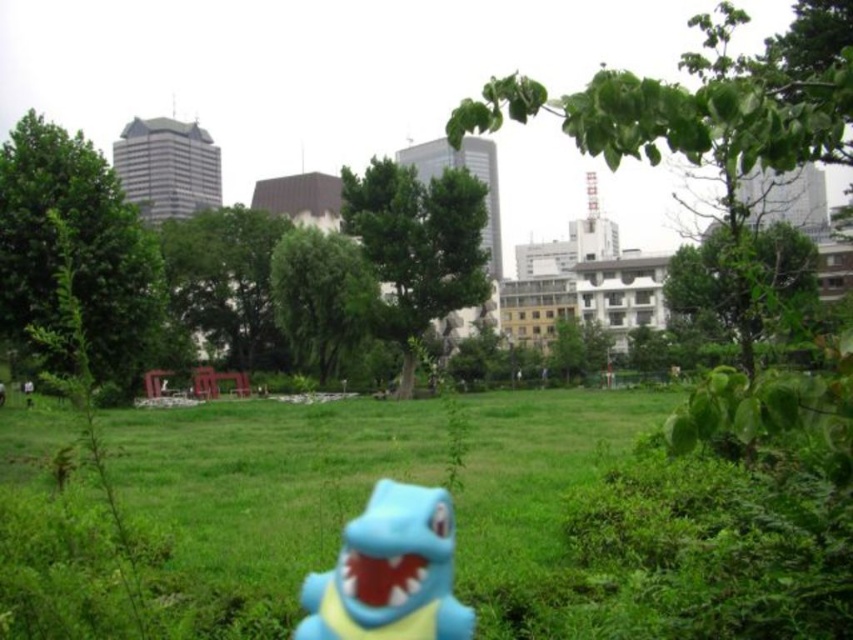
You are a photographer adjusting your camera settings to focus on two points in the park scene. The first point is at coordinate point (827, 572) and the second is at point (416, 632). Based on the scene, which point is closer to your camera lens?

Point (827, 572) is closer to the camera lens than point (416, 632) because it is further to the viewer.

You are a photographer using a camera with a shallow depth of field. You want to focus on the blue rubber toy at center while keeping the green grass at center somewhat in focus. Is this possible?

The green grass at center is further to the viewer than blue rubber toy at center, so focusing on the blue rubber toy at center would place the green grass at center behind the focal point, which may still be somewhat in focus depending on the aperture setting. This is feasible with proper camera adjustments.

You are a photographer who wants to capture the blue rubber toy at center and the green grass at center in a single photo. Based on the scene description, which object should you focus on to ensure both are in focus?

The green grass at center is positioned on the right side of blue rubber toy at center. To ensure both are in focus, you should focus on the blue rubber toy at center since it is closer to the camera than the green grass at center, which is further away. This will maximize the depth of field and keep both objects sharp.